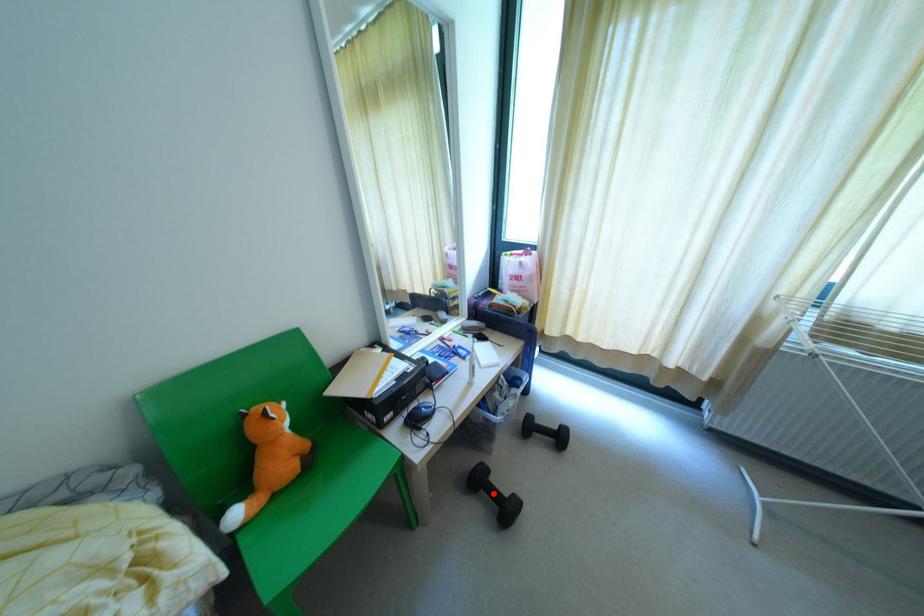
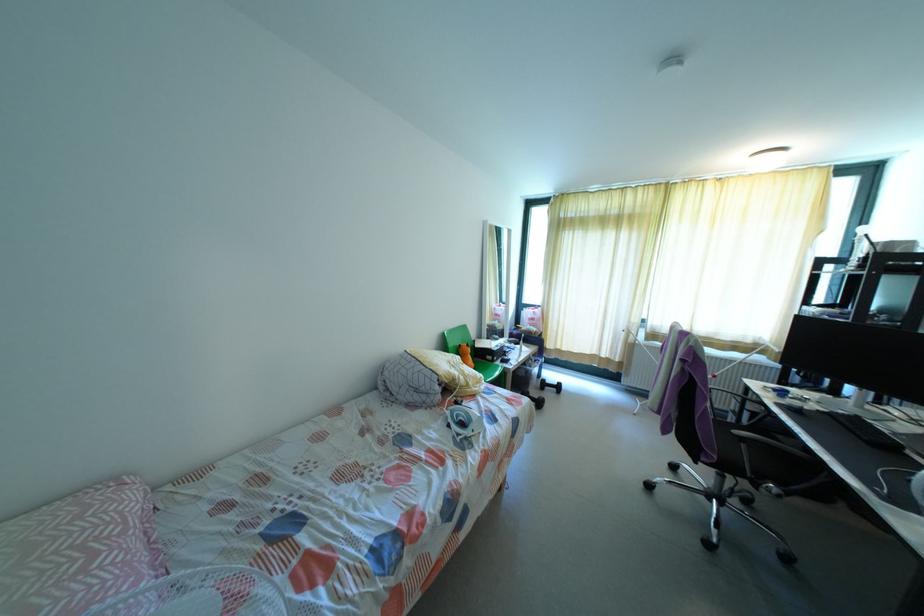
Find the pixel in the second image that matches the highlighted location in the first image.

(531, 399)